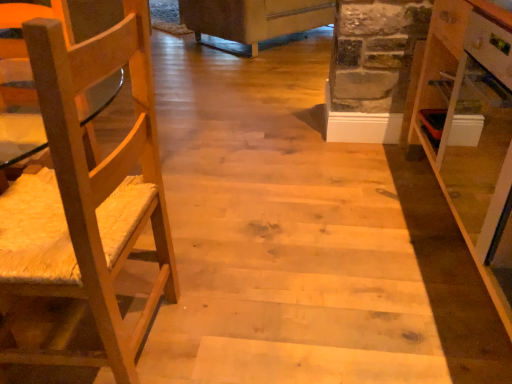
This screenshot has height=384, width=512. I want to click on free spot to the right of natural wood chair at left, so click(239, 313).